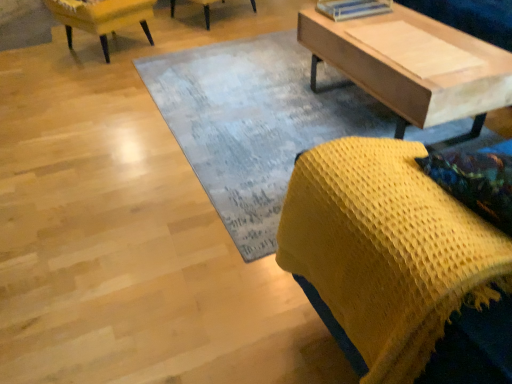
Image resolution: width=512 pixels, height=384 pixels. I want to click on vacant space in front of yellow fabric chair at upper left, marked as the 2th chair in a bottom-to-top arrangement, so click(83, 79).